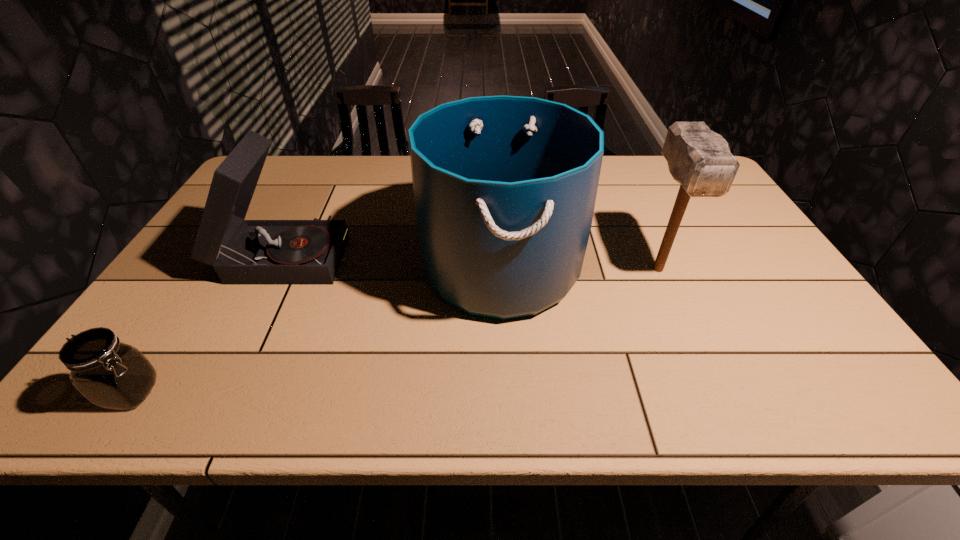
Find the location of a particular element. The height and width of the screenshot is (540, 960). phonograph_record positioned at the left edge is located at coordinates (243, 252).

Locate an element on the screen. Image resolution: width=960 pixels, height=540 pixels. jar that is at the left edge is located at coordinates tap(112, 375).

Locate an element on the screen. The height and width of the screenshot is (540, 960). object that is at the near left corner is located at coordinates (112, 375).

Identify the location of vacant space at the far edge of the desktop. (331, 164).

Where is `free space at the left edge of the desktop`? The image size is (960, 540). free space at the left edge of the desktop is located at coordinates (158, 314).

Find the location of a particular element. The height and width of the screenshot is (540, 960). free location at the right edge is located at coordinates (732, 287).

You are a GUI agent. You are given a task and a screenshot of the screen. Output one action in this format:
    pyautogui.click(x=<x>, y=<y>)
    Task: Click on the free location at the far right corner
    The width and height of the screenshot is (960, 540).
    Given the screenshot: What is the action you would take?
    pyautogui.click(x=659, y=167)

What are the coordinates of `free space between the mallet and the shortest object` in the screenshot? It's located at (395, 331).

Identify the location of free space between the second object from right to left and the jar. This screenshot has height=540, width=960. (316, 329).

At what (x,y) coordinates should I click in order to perform the action: click on vacant area that lies between the second object from right to left and the nearest object. Please return your answer as a coordinate pair (x, y). This screenshot has width=960, height=540. Looking at the image, I should click on (316, 329).